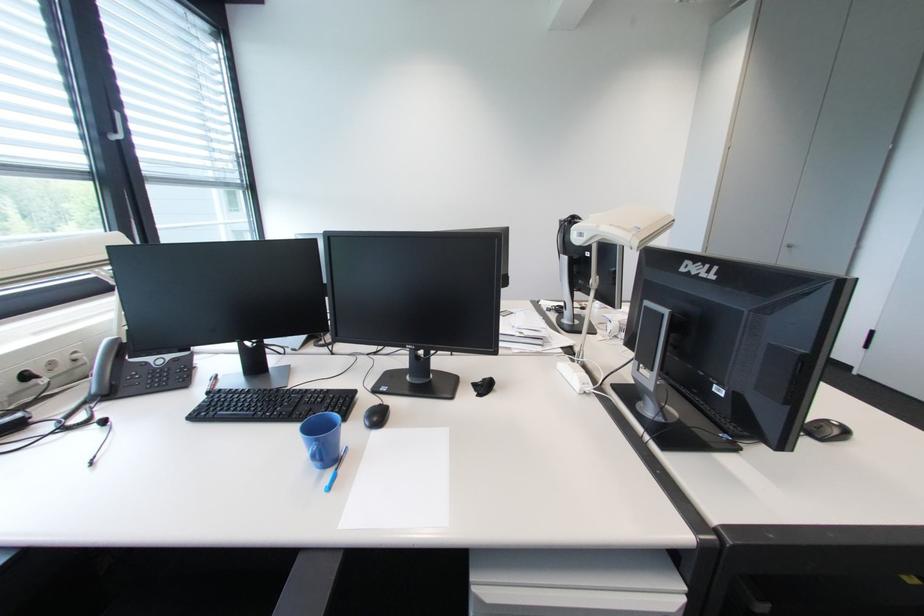
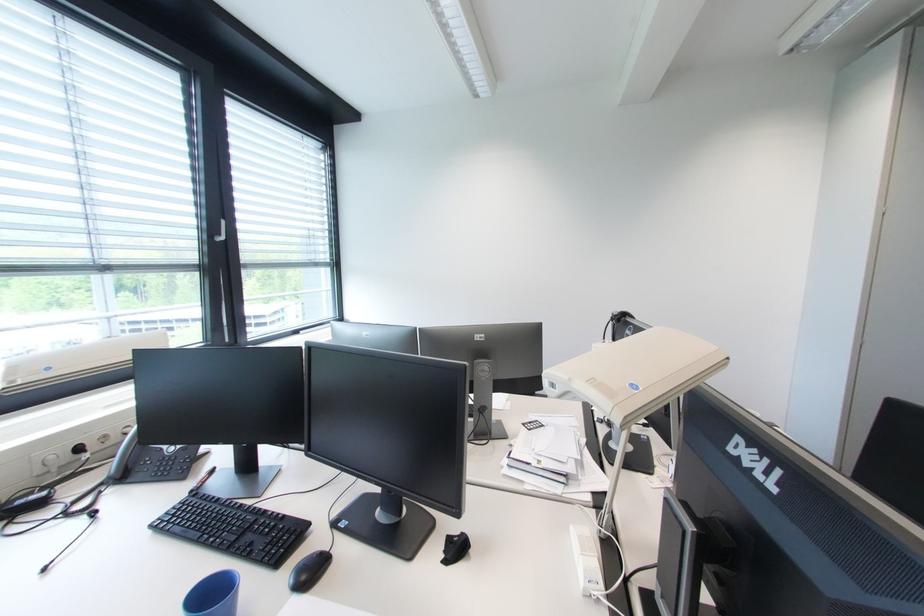
Question: The first image is from the beginning of the video and the second image is from the end. How did the camera likely rotate when shooting the video?

Choices:
 (A) Left
 (B) Right
 (C) Up
 (D) Down

Answer: (A)